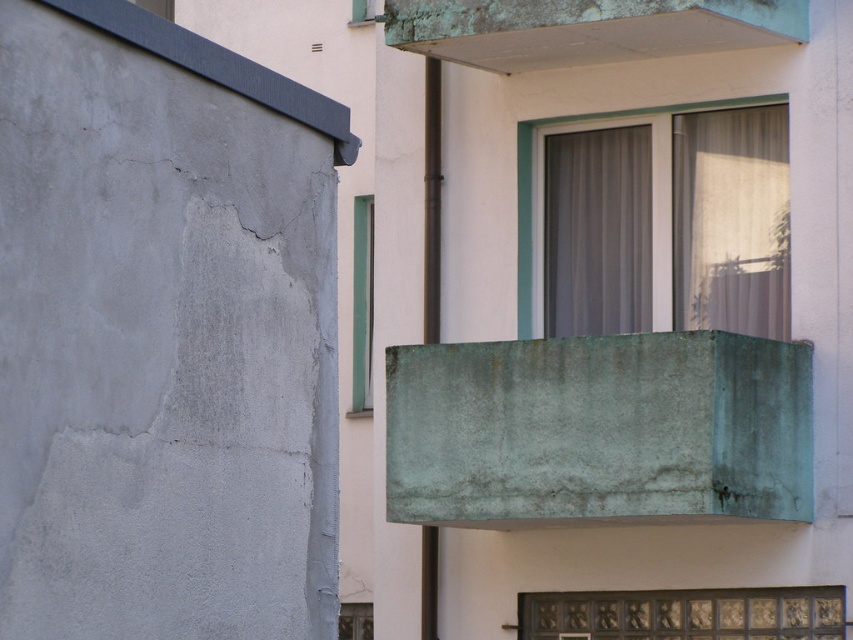
Consider the image. You are standing in front of the two structures and want to place a small potted plant. The potted plant needs to be placed on a surface that is closer to you. Which object from the smooth concrete ledge at upper left and translucent glass window at upper center should you choose?

The smooth concrete ledge at upper left is closer to the viewer than the translucent glass window at upper center, so you should place the potted plant on the smooth concrete ledge at upper left.

You are an architect analyzing the spatial relationship between the green patina concrete balcony at upper center and the sheer fabric curtain at upper center in the image. Which object is positioned higher in the scene?

The sheer fabric curtain at upper center is positioned higher than the green patina concrete balcony at upper center because the balcony is located below the curtain.